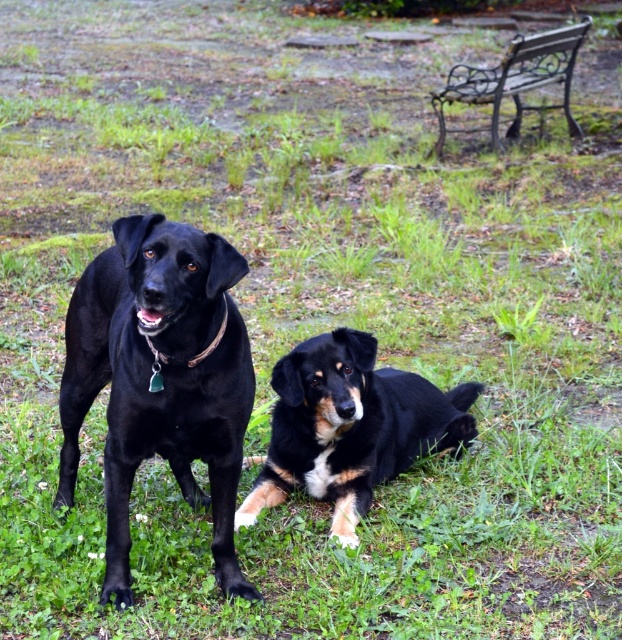
Question: Does black fur dog at center have a smaller size compared to metallic wrought iron bench at upper right?

Choices:
 (A) no
 (B) yes

Answer: (B)

Question: Which of the following is the closest to the observer?

Choices:
 (A) (383, 458)
 (B) (126, 477)
 (C) (453, 90)

Answer: (B)

Question: Is black fur dog at center behind metallic wrought iron bench at upper right?

Choices:
 (A) no
 (B) yes

Answer: (A)

Question: Which object is positioned farthest from the matte black dog at left?

Choices:
 (A) black fur dog at center
 (B) metallic wrought iron bench at upper right

Answer: (B)

Question: Is matte black dog at left behind black fur dog at center?

Choices:
 (A) yes
 (B) no

Answer: (B)

Question: Which is nearer to the black fur dog at center?

Choices:
 (A) metallic wrought iron bench at upper right
 (B) matte black dog at left

Answer: (B)